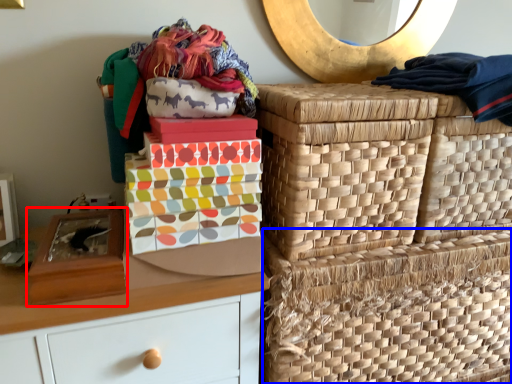
Question: Which of the following is the closest to the observer, shoe box (highlighted by a red box) or basket (highlighted by a blue box)?

Choices:
 (A) shoe box
 (B) basket

Answer: (A)